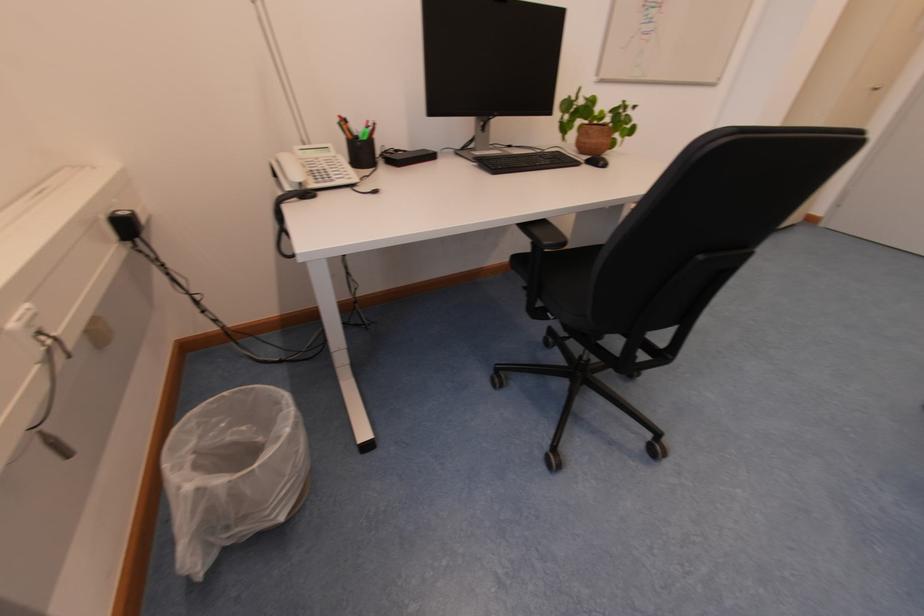
This screenshot has height=616, width=924. I want to click on chair sitting surface, so click(x=568, y=268).